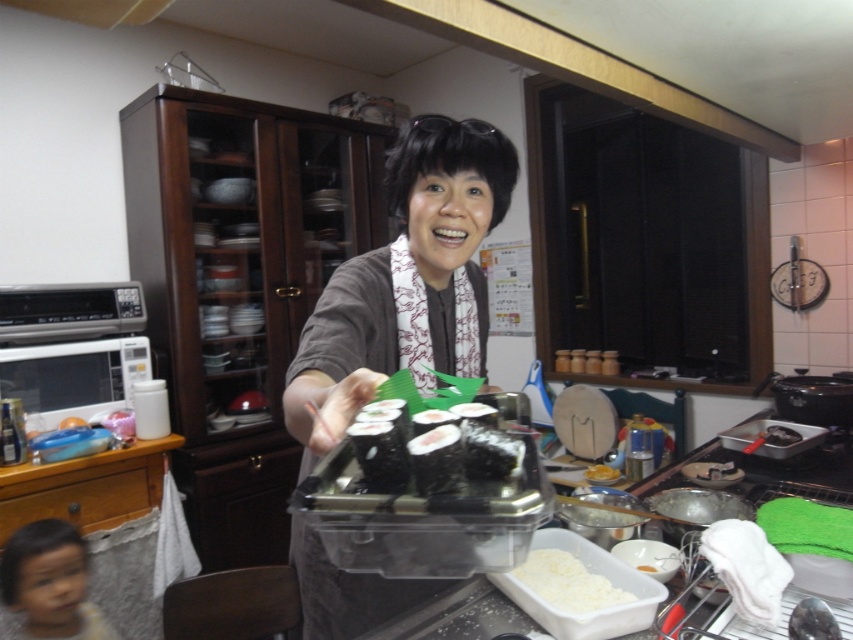
Question: Among these objects, which one is farthest from the camera?

Choices:
 (A) black seaweed sushi at center
 (B) black glossy sushi at center

Answer: (B)

Question: Is matte gray sweater at center wider than white glossy rice at lower center?

Choices:
 (A) no
 (B) yes

Answer: (B)

Question: Does matte gray sweater at center appear over white glossy rice at lower center?

Choices:
 (A) yes
 (B) no

Answer: (A)

Question: Is the position of white fluffy rice at lower center less distant than that of white glossy rice at lower center?

Choices:
 (A) no
 (B) yes

Answer: (B)

Question: Which is nearer to the matte gray sweater at center?

Choices:
 (A) black seaweed sushi at center
 (B) white glossy rice at lower center

Answer: (A)

Question: Among these points, which one is farthest from the camera?

Choices:
 (A) (595, 481)
 (B) (480, 452)
 (C) (778, 433)
 (D) (474, 132)

Answer: (A)